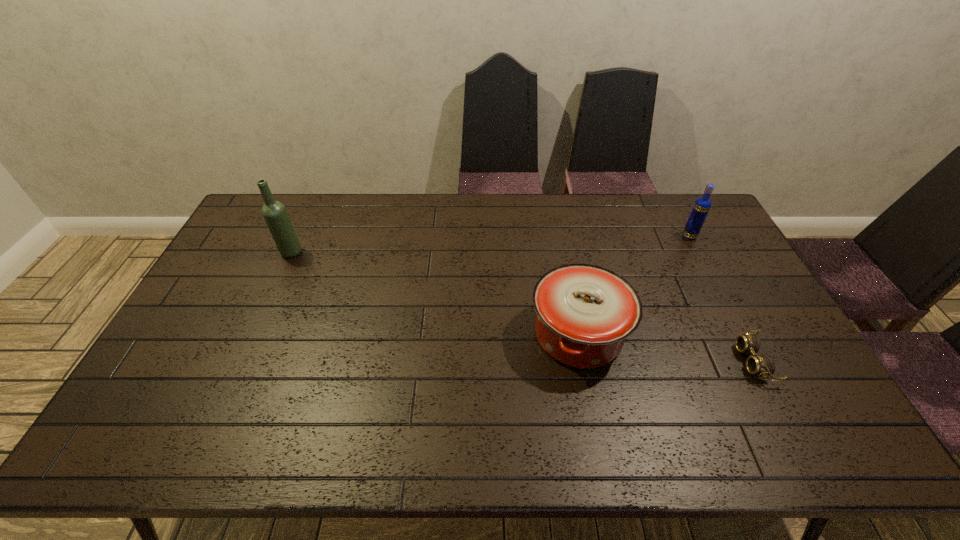
This screenshot has width=960, height=540. I want to click on blank space located 0.370m through the lenses of the goggles, so click(602, 361).

You are a GUI agent. You are given a task and a screenshot of the screen. Output one action in this format:
    pyautogui.click(x=<x>, y=<y>)
    Task: Click on the vacant space located 0.370m through the lenses of the goggles
    This screenshot has width=960, height=540.
    Given the screenshot: What is the action you would take?
    pyautogui.click(x=602, y=361)

Image resolution: width=960 pixels, height=540 pixels. In order to click on object present at the far edge in this screenshot , I will do `click(702, 205)`.

Find the location of `vodka that is at the right edge`. vodka that is at the right edge is located at coordinates (702, 205).

Where is `goggles that is at the right edge`? Image resolution: width=960 pixels, height=540 pixels. goggles that is at the right edge is located at coordinates (762, 365).

Identify the location of object at the far right corner. The width and height of the screenshot is (960, 540). (702, 205).

The width and height of the screenshot is (960, 540). I want to click on vacant space at the far edge, so click(634, 221).

Image resolution: width=960 pixels, height=540 pixels. I want to click on vacant space at the near edge of the desktop, so click(x=206, y=431).

Locate an element on the screen. This screenshot has width=960, height=540. free space at the left edge of the desktop is located at coordinates (248, 281).

This screenshot has height=540, width=960. In the image, there is a desktop. Identify the location of vacant space at the right edge. (713, 274).